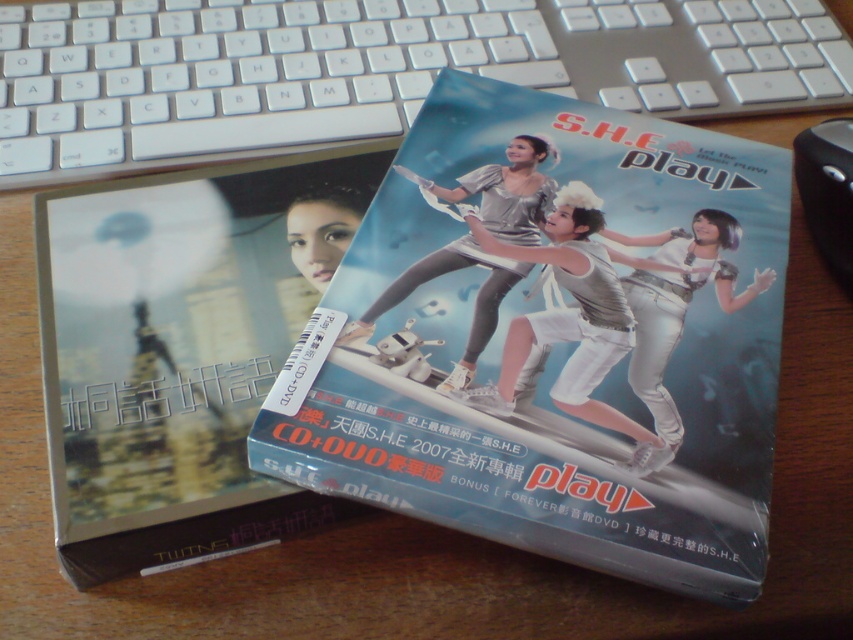
Does point (186, 124) lie in front of point (109, 289)?

No.

Between silver metallic keyboard at upper center and matte black book at left, which one is positioned lower?

matte black book at left is below.

Who is more forward, [473,32] or [108,518]?

Point [108,518] is more forward.

Identify the location of silver metallic keyboard at upper center. (372, 68).

Looking at this image, which is more to the left, silver metallic keyboard at upper center or black plastic mouse at upper right?

From the viewer's perspective, silver metallic keyboard at upper center appears more on the left side.

Between silver metallic keyboard at upper center and black plastic mouse at upper right, which one appears on the right side from the viewer's perspective?

From the viewer's perspective, black plastic mouse at upper right appears more on the right side.

Who is more forward, (18, 106) or (849, 157)?

Positioned in front is point (849, 157).

You are a GUI agent. You are given a task and a screenshot of the screen. Output one action in this format:
    pyautogui.click(x=<x>, y=<y>)
    Task: Click on the silver metallic keyboard at upper center
    The image size is (853, 640).
    Given the screenshot: What is the action you would take?
    click(x=372, y=68)

Is matte silver cd+dvd at center shorter than silver metallic keyboard at upper center?

Incorrect, matte silver cd+dvd at center's height does not fall short of silver metallic keyboard at upper center's.

Can you confirm if matte silver cd+dvd at center is taller than silver metallic keyboard at upper center?

Indeed, matte silver cd+dvd at center has a greater height compared to silver metallic keyboard at upper center.

Between point (480, 477) and point (49, 48), which one is positioned in front?

Point (480, 477) is in front.

What are the coordinates of `matte silver cd+dvd at center` in the screenshot? It's located at (555, 340).